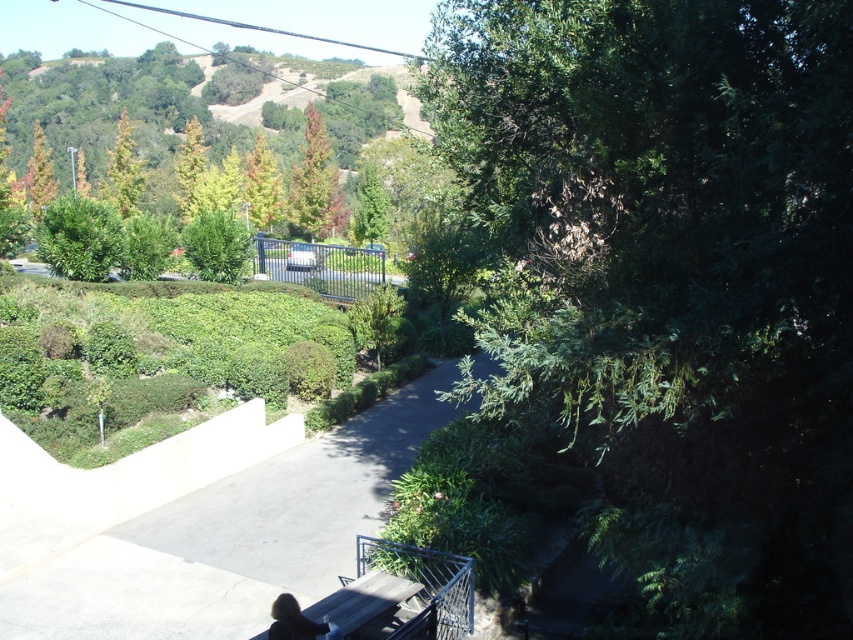
You are standing at the point marked as point (314, 180) in the image. What object is directly in front of you?

The green matte tree at center is directly in front of you at point (314, 180).

You are standing on a balcony and see the green matte tree at center and the dark brown leather jacket at lower center. Which object is closer to the left edge of the balcony?

The green matte tree at center is positioned on the left side of the dark brown leather jacket at lower center, so it is closer to the left edge of the balcony.